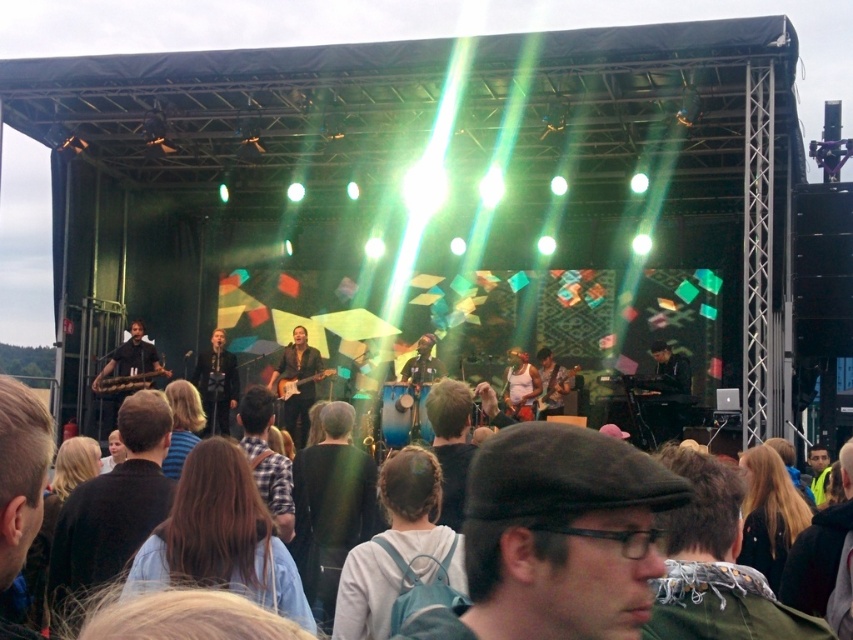
Question: Can you confirm if matte black shirt at center is positioned below white matte tank top at center?

Choices:
 (A) yes
 (B) no

Answer: (B)

Question: Is shiny brown guitar at center to the right of white matte tank top at center from the viewer's perspective?

Choices:
 (A) yes
 (B) no

Answer: (B)

Question: Which point appears closest to the camera in this image?

Choices:
 (A) (548, 394)
 (B) (321, 362)
 (C) (227, 371)
 (D) (519, 362)

Answer: (A)

Question: Estimate the real-world distances between objects in this image. Which object is closer to the shiny brown guitar at center?

Choices:
 (A) white matte tank top at center
 (B) wooden guitar at center
 (C) matte black shirt at center

Answer: (C)

Question: Which object is positioned farthest from the shiny brown guitar at center?

Choices:
 (A) matte black shirt at center
 (B) white matte tank top at center

Answer: (B)

Question: Is matte black shirt at center in front of white matte tank top at center?

Choices:
 (A) no
 (B) yes

Answer: (A)